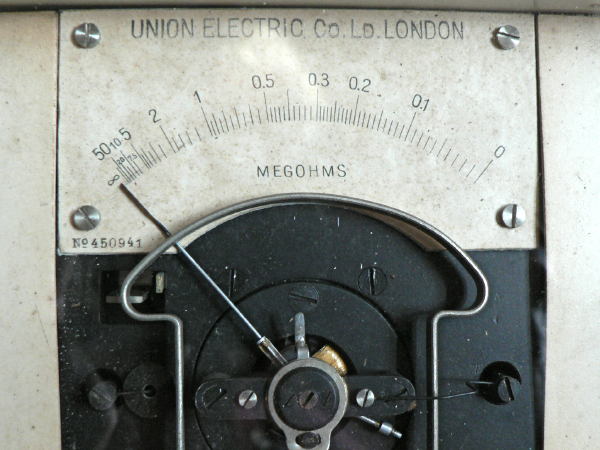
Locate an element on the screen. metal brackets is located at coordinates (480, 299), (172, 318).